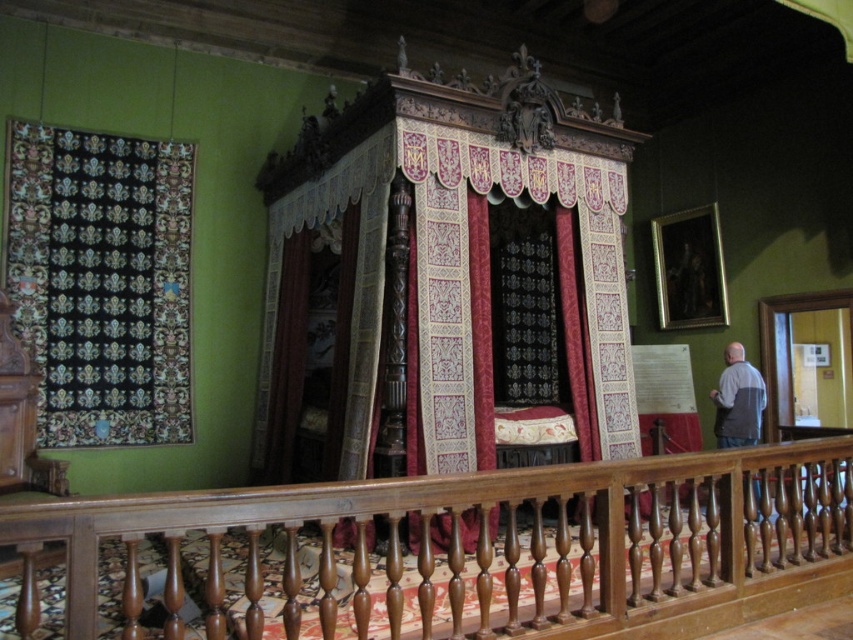
You are a tour guide leading a group through this historical room. You need to move a small decorative item from the wooden balustrade at center to the gray fabric apron at right. Is the space between them wide enough for you to carry the item without needing to move around any obstacles?

The distance between the wooden balustrade at center and the gray fabric apron at right is 8.40 feet, which is sufficient space for a tour guide to move a small decorative item without needing to navigate around obstacles.

You are standing in the room and want to know which of the two points, point (300,611) or point (409,161), is closer to you. Can you determine this based on the description?

Point (300,611) is closer to the camera than point (409,161), so it is closer to you.